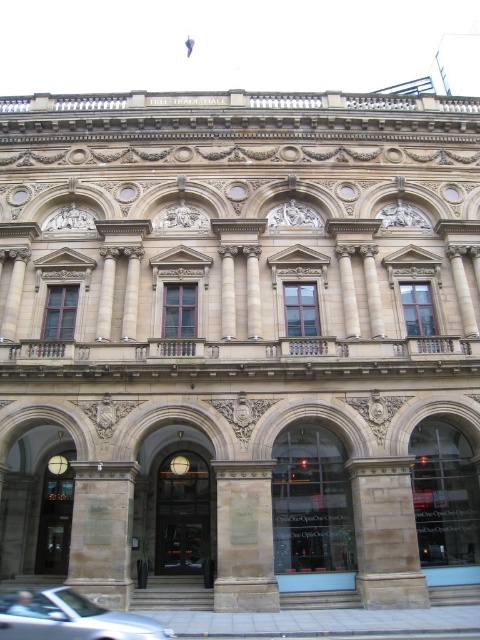
Question: Which of the following is the closest to the observer?

Choices:
 (A) (122, 604)
 (B) (267, 486)
 (C) (363, 472)

Answer: (A)

Question: Does brown stone pillar at center appear on the left side of silver metallic car at lower left?

Choices:
 (A) no
 (B) yes

Answer: (A)

Question: Which object appears closest to the camera in this image?

Choices:
 (A) brown stone pillar at lower left
 (B) silver metallic car at lower left
 (C) brown stone pillar at center

Answer: (B)

Question: Which point appears closest to the camera in this image?

Choices:
 (A) (92, 468)
 (B) (1, 595)
 (C) (384, 582)
 (D) (252, 564)

Answer: (B)

Question: Does stone textured column at center have a greater width compared to brown stone pillar at lower left?

Choices:
 (A) no
 (B) yes

Answer: (B)

Question: Does brown stone pillar at center come in front of stone textured column at center?

Choices:
 (A) yes
 (B) no

Answer: (B)